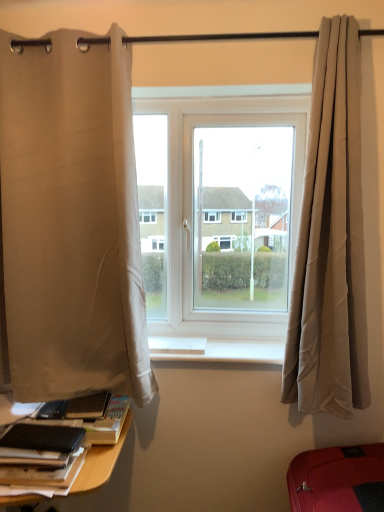
Question: Is beige fabric curtain at right, the first curtain from the right, not close to white smooth window sill at center?

Choices:
 (A) yes
 (B) no

Answer: (B)

Question: Does beige fabric curtain at right, the first curtain from the right, have a smaller size compared to white smooth window sill at center?

Choices:
 (A) yes
 (B) no

Answer: (B)

Question: From the image's perspective, would you say beige fabric curtain at right, the 2th curtain when ordered from left to right, is positioned over white smooth window sill at center?

Choices:
 (A) yes
 (B) no

Answer: (A)

Question: Does beige fabric curtain at right, the first curtain from the right, have a lesser height compared to white smooth window sill at center?

Choices:
 (A) no
 (B) yes

Answer: (A)

Question: Does beige fabric curtain at right, the 2th curtain when ordered from left to right, have a lesser width compared to white smooth window sill at center?

Choices:
 (A) yes
 (B) no

Answer: (A)

Question: From their relative heights in the image, would you say white fabric curtain at left, the first curtain viewed from the left, is taller or shorter than beige fabric curtain at right, the first curtain from the right?

Choices:
 (A) short
 (B) tall

Answer: (A)

Question: From a real-world perspective, is white fabric curtain at left, the second curtain from the right, positioned above or below beige fabric curtain at right, the first curtain from the right?

Choices:
 (A) below
 (B) above

Answer: (B)

Question: Is white fabric curtain at left, the first curtain viewed from the left, in front of or behind beige fabric curtain at right, the first curtain from the right, in the image?

Choices:
 (A) behind
 (B) front

Answer: (A)

Question: In terms of size, does white fabric curtain at left, the first curtain viewed from the left, appear bigger or smaller than beige fabric curtain at right, the first curtain from the right?

Choices:
 (A) big
 (B) small

Answer: (A)

Question: Considering the relative positions of beige fabric curtain at right, the first curtain from the right, and white smooth window sill at center in the image provided, is beige fabric curtain at right, the first curtain from the right, to the left or to the right of white smooth window sill at center?

Choices:
 (A) left
 (B) right

Answer: (B)

Question: From a real-world perspective, is beige fabric curtain at right, the 2th curtain when ordered from left to right, above or below white smooth window sill at center?

Choices:
 (A) below
 (B) above

Answer: (B)

Question: In the image, is beige fabric curtain at right, the first curtain from the right, positioned in front of or behind white smooth window sill at center?

Choices:
 (A) behind
 (B) front

Answer: (B)

Question: In terms of width, does beige fabric curtain at right, the 2th curtain when ordered from left to right, look wider or thinner when compared to white smooth window sill at center?

Choices:
 (A) wide
 (B) thin

Answer: (B)

Question: Is point (281, 138) closer or farther from the camera than point (3, 259)?

Choices:
 (A) closer
 (B) farther

Answer: (B)

Question: From a real-world perspective, is white plastic window at center positioned above or below white fabric curtain at left, the second curtain from the right?

Choices:
 (A) above
 (B) below

Answer: (B)